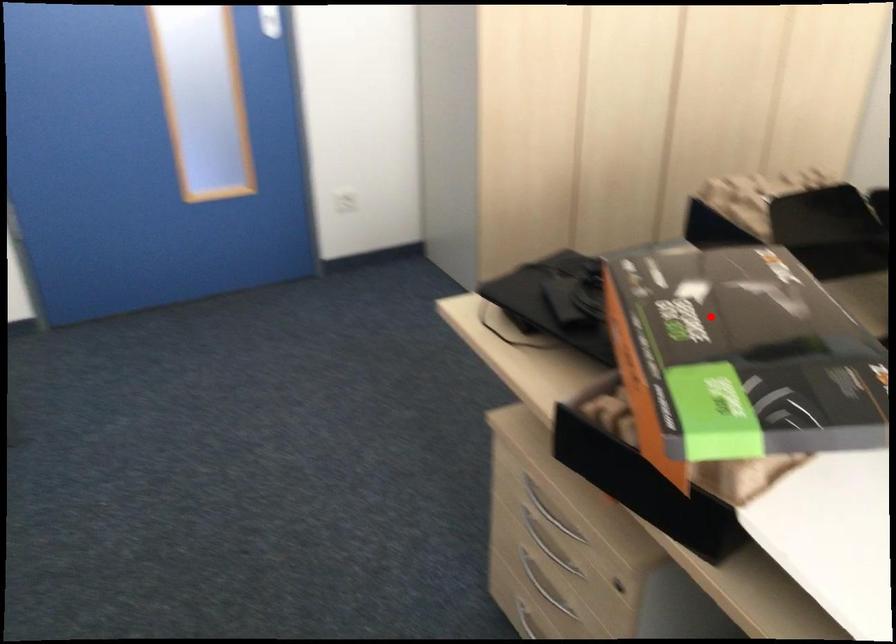
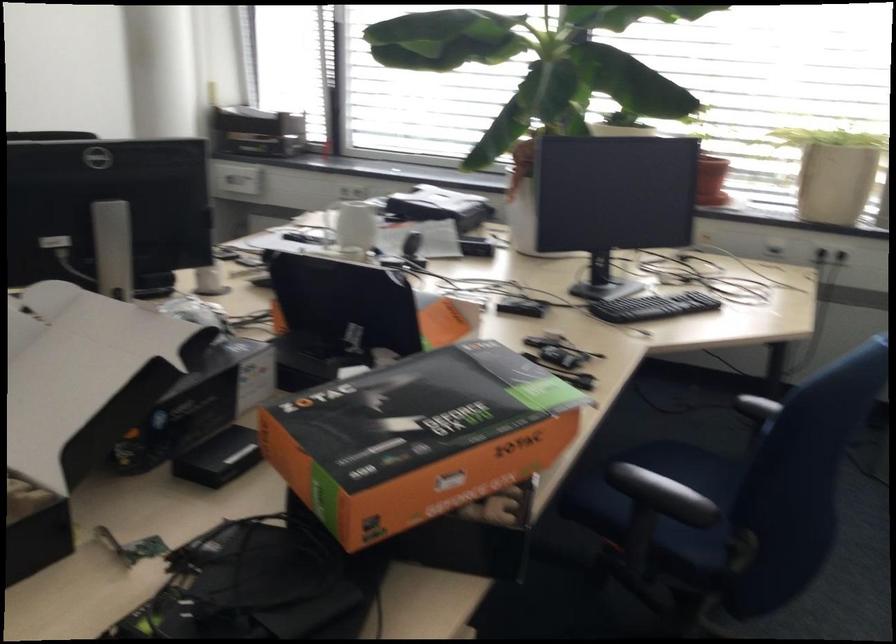
Question: A red point is marked in image1. In image2, is the corresponding 3D point closer to the camera or farther? Reply with the corresponding letter.

Choices:
 (A) The corresponding 3D point is closer.
 (B) The corresponding 3D point is farther.

Answer: (B)